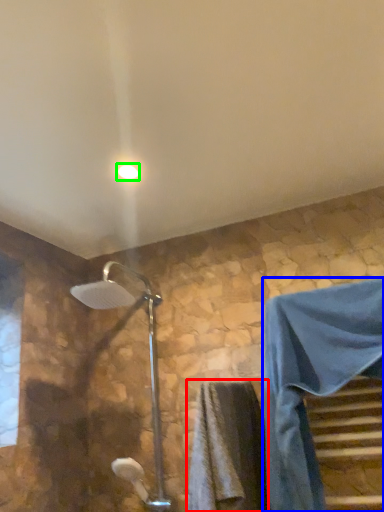
Question: Which is nearer to the bath towel (highlighted by a red box)? robe (highlighted by a blue box) or light fixture (highlighted by a green box).

Choices:
 (A) robe
 (B) light fixture

Answer: (A)